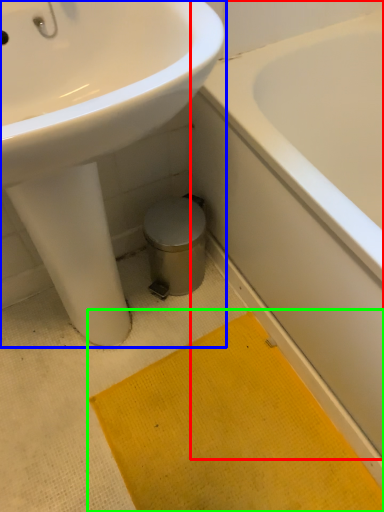
Question: Which object is positioned closest to bathtub (highlighted by a red box)? Select from sink (highlighted by a blue box) and bath mat (highlighted by a green box).

Choices:
 (A) sink
 (B) bath mat

Answer: (B)